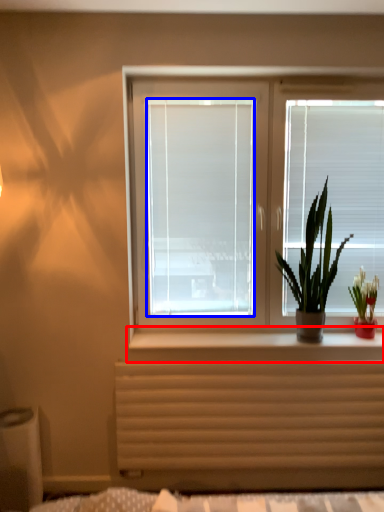
Question: Among these objects, which one is farthest to the camera, window sill (highlighted by a red box) or window screen (highlighted by a blue box)?

Choices:
 (A) window sill
 (B) window screen

Answer: (B)